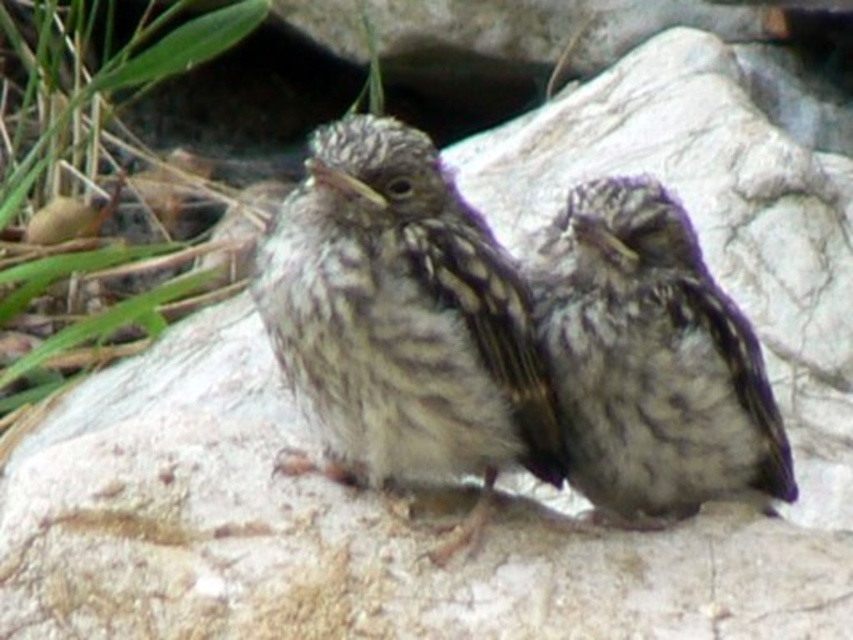
You are a birdwatcher observing two sparrows on a rock. You notice that one is a brown speckled sparrow at center and the other is a speckled feathered sparrow at center. Which of the two sparrows is taller?

The brown speckled sparrow at center is much taller than the speckled feathered sparrow at center.

You are a birdwatcher observing two sparrows on a rock. You notice a brown speckled sparrow at center and a speckled feathered sparrow at center. Which of these two birds is positioned more to the left?

The brown speckled sparrow at center is positioned to the left of the speckled feathered sparrow at center.